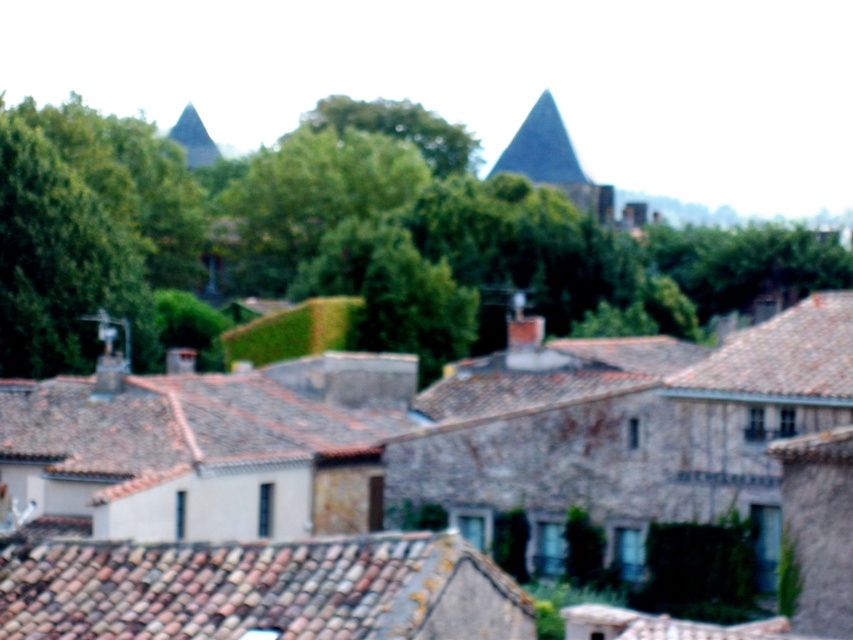
Which of these two, brown tile roof at upper right or dark gray stone roof at upper center, stands taller?

Standing taller between the two is dark gray stone roof at upper center.

Which is in front, point (708, 358) or point (540, 102)?

Point (708, 358)

This screenshot has width=853, height=640. I want to click on brown tile roof at upper right, so click(784, 353).

Does brown tile roof at lower center lie in front of brown tile roof at upper right?

Yes.

Can you confirm if brown tile roof at lower center is positioned to the right of brown tile roof at upper right?

Incorrect, brown tile roof at lower center is not on the right side of brown tile roof at upper right.

This screenshot has height=640, width=853. What are the coordinates of `brown tile roof at lower center` in the screenshot? It's located at coord(263,589).

This screenshot has width=853, height=640. Identify the location of brown tile roof at lower center. (263, 589).

Is brown tile roof at lower center closer to the viewer compared to dark gray stone roof at upper center?

Yes, it is in front of dark gray stone roof at upper center.

From the picture: Which is above, brown tile roof at lower center or dark gray stone roof at upper center?

dark gray stone roof at upper center is higher up.

Locate an element on the screen. Image resolution: width=853 pixels, height=640 pixels. brown tile roof at lower center is located at coordinates (263, 589).

Image resolution: width=853 pixels, height=640 pixels. Find the location of `brown tile roof at lower center`. brown tile roof at lower center is located at coordinates (263, 589).